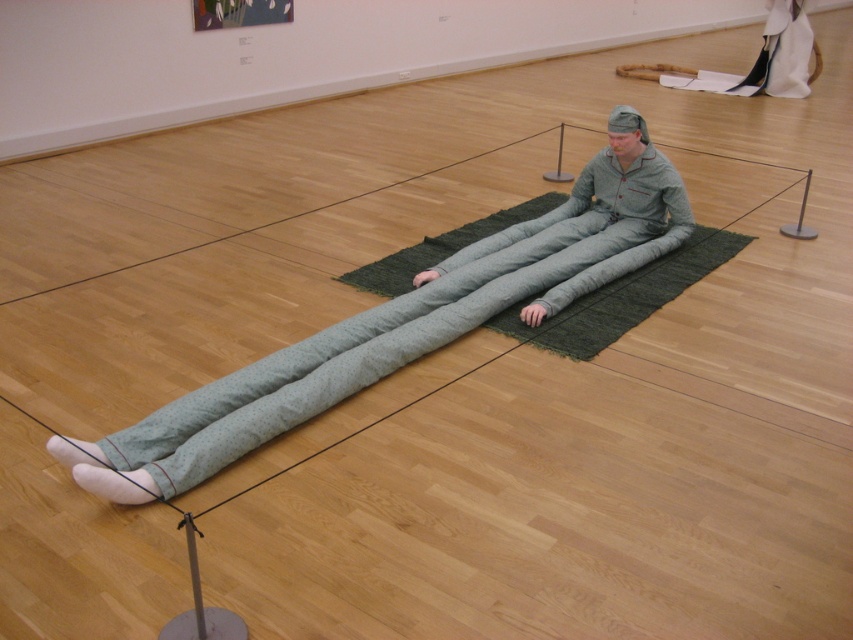
Is point (412, 323) positioned after point (751, 236)?

No, it is not.

Who is more forward, (387, 353) or (590, 310)?

Positioned in front is point (387, 353).

In order to click on green fabric figure at center in this screenshot , I will do `click(404, 323)`.

At what (x,y) coordinates should I click in order to perform the action: click on green fabric figure at center. Please return your answer as a coordinate pair (x, y). The image size is (853, 640). Looking at the image, I should click on (404, 323).